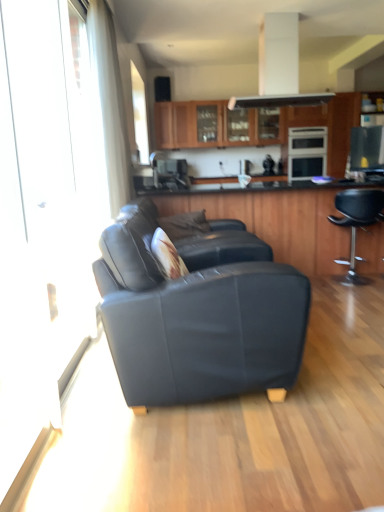
Question: Which direction should I rotate to look at satin black oven at center, marked as the second appliance in a front-to-back arrangement?

Choices:
 (A) left
 (B) right

Answer: (B)

Question: From the image's perspective, is wooden cabinets at upper center, placed as the second cabinetry when sorted from front to back, below wooden cabinet at center, placed as the second cabinetry when sorted from back to front?

Choices:
 (A) yes
 (B) no

Answer: (B)

Question: Does wooden cabinets at upper center, arranged as the second cabinetry when ordered from the bottom, appear on the left side of wooden cabinet at center, which is the 1th cabinetry from front to back?

Choices:
 (A) no
 (B) yes

Answer: (B)

Question: From the image's perspective, is wooden cabinets at upper center, placed as the second cabinetry when sorted from front to back, over wooden cabinet at center, placed as the second cabinetry when sorted from back to front?

Choices:
 (A) yes
 (B) no

Answer: (A)

Question: Can you confirm if wooden cabinets at upper center, arranged as the second cabinetry when ordered from the bottom, is taller than wooden cabinet at center, which is the 1th cabinetry from front to back?

Choices:
 (A) no
 (B) yes

Answer: (A)

Question: From a real-world perspective, is wooden cabinets at upper center, which is the 1th cabinetry from top to bottom, on wooden cabinet at center, which is the 1th cabinetry from front to back?

Choices:
 (A) no
 (B) yes

Answer: (B)

Question: Does wooden cabinets at upper center, which is the 1th cabinetry from top to bottom, have a larger size compared to wooden cabinet at center, acting as the second cabinetry starting from the top?

Choices:
 (A) no
 (B) yes

Answer: (A)

Question: Is satin black oven at center, the 1th appliance positioned from the back, oriented towards matte black couch at center?

Choices:
 (A) no
 (B) yes

Answer: (A)

Question: Can you confirm if satin black oven at center, marked as the second appliance in a front-to-back arrangement, is thinner than matte black couch at center?

Choices:
 (A) no
 (B) yes

Answer: (B)

Question: Is satin black oven at center, which is the 1th appliance from top to bottom, looking in the opposite direction of matte black couch at center?

Choices:
 (A) no
 (B) yes

Answer: (A)

Question: Is satin black oven at center, the 1th appliance positioned from the back, taller than matte black couch at center?

Choices:
 (A) yes
 (B) no

Answer: (B)

Question: Is satin black oven at center, which is counted as the second appliance, starting from the bottom, smaller than matte black couch at center?

Choices:
 (A) no
 (B) yes

Answer: (B)

Question: Considering the relative sizes of satin black microwave at upper right, which appears as the first appliance when ordered from the bottom, and satin black oven at center, the 1th appliance positioned from the back, in the image provided, is satin black microwave at upper right, which appears as the first appliance when ordered from the bottom, shorter than satin black oven at center, the 1th appliance positioned from the back,?

Choices:
 (A) no
 (B) yes

Answer: (B)